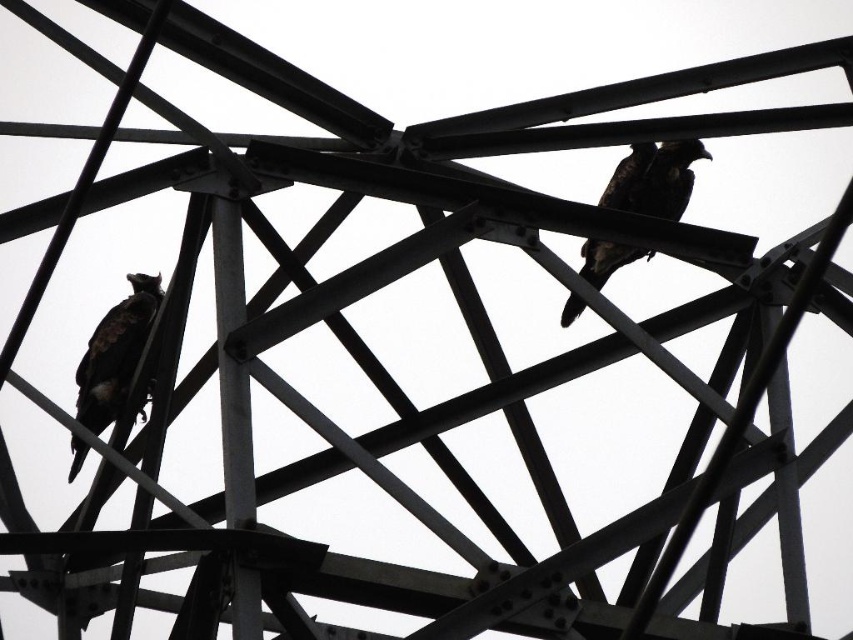
Does dark brown feathers at left have a greater width compared to brown feathered bird at upper center?

No.

Where is `dark brown feathers at left`? Image resolution: width=853 pixels, height=640 pixels. dark brown feathers at left is located at coordinates (115, 353).

Is point (123, 376) farther from viewer compared to point (689, 176)?

No, (123, 376) is closer to viewer.

Where is `dark brown feathers at left`? This screenshot has width=853, height=640. dark brown feathers at left is located at coordinates (115, 353).